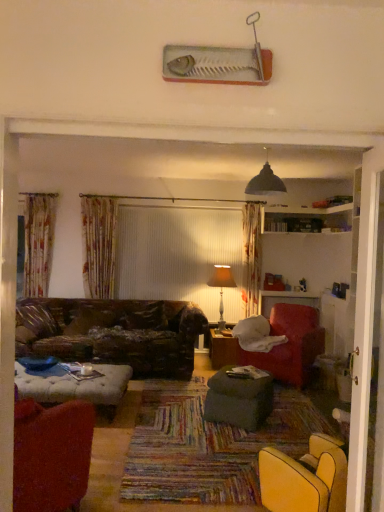
The image size is (384, 512). I want to click on velvet red armchair at lower left, marked as the first chair in a left-to-right arrangement, so click(51, 455).

Is point (70, 440) positioned in front of point (278, 322)?

That is True.

Is velvet red armchair at lower left, which is the second chair from right to left, oriented towards velvet red armchair at right, acting as the 1th chair starting from the back?

Yes, velvet red armchair at lower left, which is the second chair from right to left, faces towards velvet red armchair at right, acting as the 1th chair starting from the back.

Considering the sizes of objects velvet red armchair at lower left, the first chair in the front-to-back sequence, and velvet red armchair at right, placed as the 2th chair when sorted from left to right, in the image provided, who is smaller, velvet red armchair at lower left, the first chair in the front-to-back sequence, or velvet red armchair at right, placed as the 2th chair when sorted from left to right,?

velvet red armchair at lower left, the first chair in the front-to-back sequence, is smaller.

From a real-world perspective, is velvet red armchair at lower left, which is the second chair from right to left, on top of velvet red armchair at right, acting as the 1th chair starting from the back?

Incorrect, from a real-world perspective, velvet red armchair at lower left, which is the second chair from right to left, is lower than velvet red armchair at right, acting as the 1th chair starting from the back.

Find the location of `table in front of the black matte lampshade at upper center`. table in front of the black matte lampshade at upper center is located at coordinates (238, 400).

Is dark green fabric ottoman at center, which appears as the second table when viewed from the back, at the right side of black matte lampshade at upper center?

No, dark green fabric ottoman at center, which appears as the second table when viewed from the back, is not to the right of black matte lampshade at upper center.

Is point (221, 421) behind point (264, 190)?

No, (221, 421) is in front of (264, 190).

Which object is thinner, black matte lampshade at upper center or dark green fabric ottoman at center, which is counted as the first table, starting from the front?

With smaller width is black matte lampshade at upper center.

The image size is (384, 512). Identify the location of table that is the 2nd one when counting leftward from the black matte lampshade at upper center. (238, 400).

From the picture: Is dark green fabric ottoman at center, which is counted as the first table, starting from the front, inside black matte lampshade at upper center?

No.

Considering the sizes of objects black matte lampshade at upper center and dark green fabric ottoman at center, which is counted as the first table, starting from the front, in the image provided, who is bigger, black matte lampshade at upper center or dark green fabric ottoman at center, which is counted as the first table, starting from the front,?

With larger size is dark green fabric ottoman at center, which is counted as the first table, starting from the front.

Does point (224, 404) come behind point (228, 354)?

No, (224, 404) is closer to viewer.

Looking at this image, which object is positioned more to the left, dark green fabric ottoman at center, which appears as the second table when viewed from the back, or wooden table at center, acting as the 1th table starting from the back?

Positioned to the left is dark green fabric ottoman at center, which appears as the second table when viewed from the back.

Do you think dark green fabric ottoman at center, which is counted as the first table, starting from the front, is within wooden table at center, acting as the 1th table starting from the back, or outside of it?

dark green fabric ottoman at center, which is counted as the first table, starting from the front, cannot be found inside wooden table at center, acting as the 1th table starting from the back.

Can you confirm if velvet red armchair at right, which is the 2th chair from front to back, is shorter than velvet red armchair at lower left, marked as the first chair in a left-to-right arrangement?

Yes, velvet red armchair at right, which is the 2th chair from front to back, is shorter than velvet red armchair at lower left, marked as the first chair in a left-to-right arrangement.

Based on their sizes in the image, would you say velvet red armchair at right, arranged as the first chair when viewed from the right, is bigger or smaller than velvet red armchair at lower left, the first chair in the front-to-back sequence?

velvet red armchair at right, arranged as the first chair when viewed from the right, is bigger than velvet red armchair at lower left, the first chair in the front-to-back sequence.

Is velvet red armchair at lower left, the first chair in the front-to-back sequence, located within velvet red armchair at right, placed as the 2th chair when sorted from left to right?

No, velvet red armchair at lower left, the first chair in the front-to-back sequence, is not surrounded by velvet red armchair at right, placed as the 2th chair when sorted from left to right.

Is velvet red armchair at right, placed as the 2th chair when sorted from left to right, facing towards velvet red armchair at lower left, which is the second chair from right to left?

Yes, velvet red armchair at right, placed as the 2th chair when sorted from left to right, faces towards velvet red armchair at lower left, which is the second chair from right to left.

From a real-world perspective, which is physically above, velvet red armchair at right, acting as the 1th chair starting from the back, or matte beige lampshade at center?

matte beige lampshade at center, from a real-world perspective.

Looking at this image, is velvet red armchair at right, which is the 2th chair from front to back, oriented towards matte beige lampshade at center?

No, velvet red armchair at right, which is the 2th chair from front to back, is not facing towards matte beige lampshade at center.

From a real-world perspective, count 1st chairs downward from the matte beige lampshade at center and point to it. Please provide its 2D coordinates.

[(290, 344)]

Is velvet red armchair at right, arranged as the first chair when viewed from the right, spatially inside matte beige lampshade at center, or outside of it?

velvet red armchair at right, arranged as the first chair when viewed from the right, cannot be found inside matte beige lampshade at center.

Is point (277, 328) closer or farther from the camera than point (218, 399)?

Point (277, 328) is positioned farther from the camera compared to point (218, 399).

From a real-world perspective, which is physically above, velvet red armchair at right, placed as the 2th chair when sorted from left to right, or dark green fabric ottoman at center, which is counted as the first table, starting from the front?

From a 3D spatial view, velvet red armchair at right, placed as the 2th chair when sorted from left to right, is above.

The width and height of the screenshot is (384, 512). Identify the location of chair below the velvet red armchair at right, arranged as the first chair when viewed from the right (from the image's perspective). (51, 455).

Identify the location of light fixture above the dark green fabric ottoman at center, which is counted as the first table, starting from the front (from the image's perspective). The image size is (384, 512). (265, 181).

Considering their positions, is velvet red armchair at lower left, which is the second chair from right to left, positioned closer to black matte lampshade at upper center than velvet red armchair at right, placed as the 2th chair when sorted from left to right?

velvet red armchair at right, placed as the 2th chair when sorted from left to right, lies closer to black matte lampshade at upper center than the other object.

From the image, which object appears to be farther from matte beige lampshade at center, dark green fabric ottoman at center, which appears as the second table when viewed from the back, or velvet red armchair at lower left, which is the second chair from back to front?

Based on the image, velvet red armchair at lower left, which is the second chair from back to front, appears to be further to matte beige lampshade at center.

Consider the image. Estimate the real-world distances between objects in this image. Which object is closer to matte beige lampshade at center, dark green fabric ottoman at center, which is counted as the first table, starting from the front, or wooden table at center, acting as the 1th table starting from the back?

wooden table at center, acting as the 1th table starting from the back, is positioned closer to the anchor matte beige lampshade at center.

Based on their spatial positions, is velvet red armchair at right, acting as the 1th chair starting from the back, or wooden table at center, acting as the 1th table starting from the back, closer to dark green fabric ottoman at center, which appears as the second table when viewed from the back?

wooden table at center, acting as the 1th table starting from the back, lies closer to dark green fabric ottoman at center, which appears as the second table when viewed from the back, than the other object.

Which object lies nearer to the anchor point matte beige lampshade at center, black matte lampshade at upper center or velvet red armchair at right, acting as the 1th chair starting from the back?

velvet red armchair at right, acting as the 1th chair starting from the back.

When comparing their distances from black matte lampshade at upper center, does wooden table at center, acting as the 1th table starting from the back, or velvet red armchair at lower left, the first chair in the front-to-back sequence, seem closer?

wooden table at center, acting as the 1th table starting from the back, is positioned closer to the anchor black matte lampshade at upper center.

Considering their positions, is velvet red armchair at lower left, which is the second chair from back to front, positioned further to dark green fabric ottoman at center, which appears as the second table when viewed from the back, than black matte lampshade at upper center?

black matte lampshade at upper center is further to dark green fabric ottoman at center, which appears as the second table when viewed from the back.

When comparing their distances from velvet red armchair at right, which is the 2th chair from front to back, does matte beige lampshade at center or black matte lampshade at upper center seem closer?

Among the two, matte beige lampshade at center is located nearer to velvet red armchair at right, which is the 2th chair from front to back.

I want to click on table located between dark green fabric ottoman at center, which is counted as the first table, starting from the front, and matte beige lampshade at center in the depth direction, so click(x=222, y=349).

Identify the location of light fixture between velvet red armchair at lower left, which is the second chair from back to front, and matte beige lampshade at center, along the z-axis. The width and height of the screenshot is (384, 512). (265, 181).

Image resolution: width=384 pixels, height=512 pixels. Identify the location of chair between velvet red armchair at lower left, which is the second chair from right to left, and matte beige lampshade at center, along the z-axis. click(x=290, y=344).

In order to click on table between black matte lampshade at upper center and dark green fabric ottoman at center, which appears as the second table when viewed from the back, from top to bottom in this screenshot , I will do `click(222, 349)`.